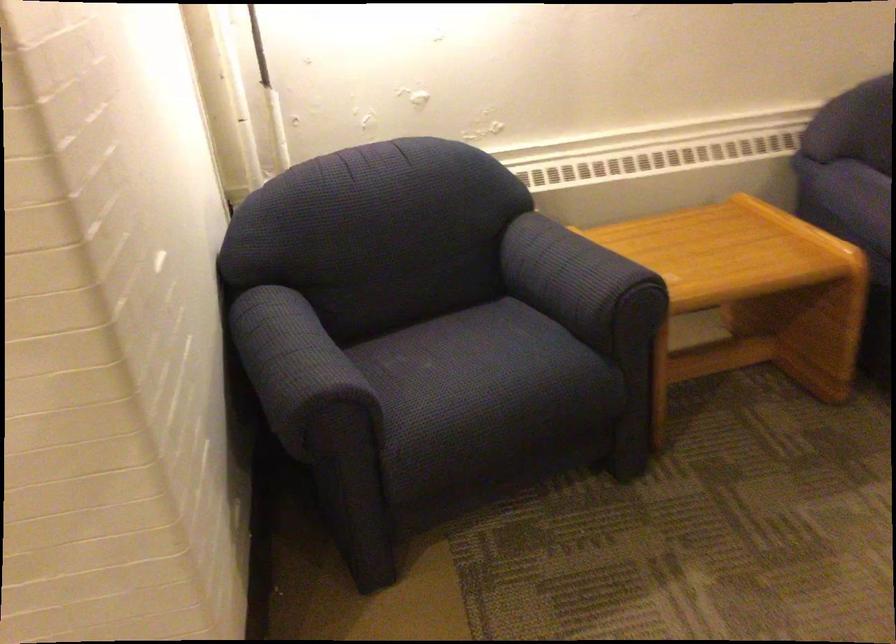
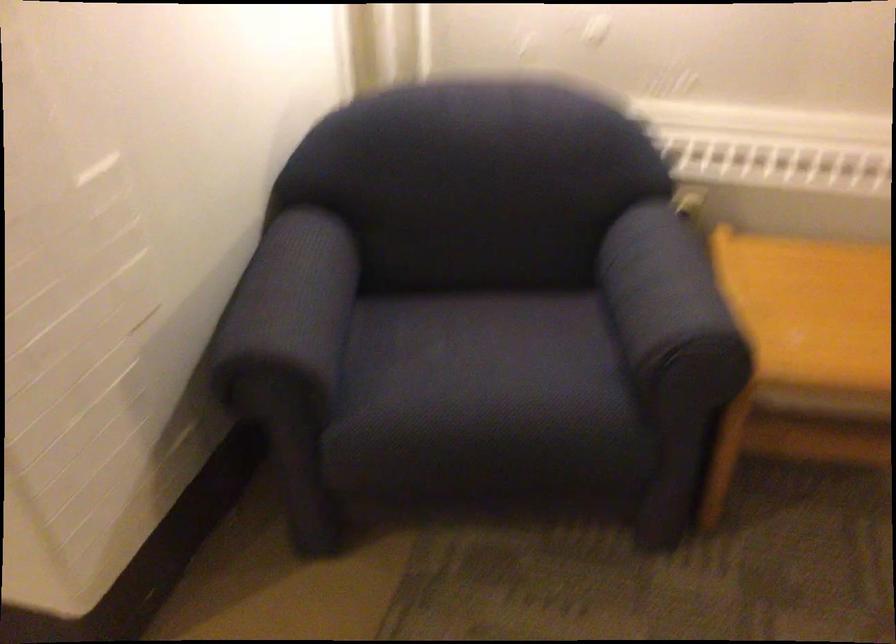
Locate, in the second image, the point that corresponds to [606,272] in the first image.

(670, 307)